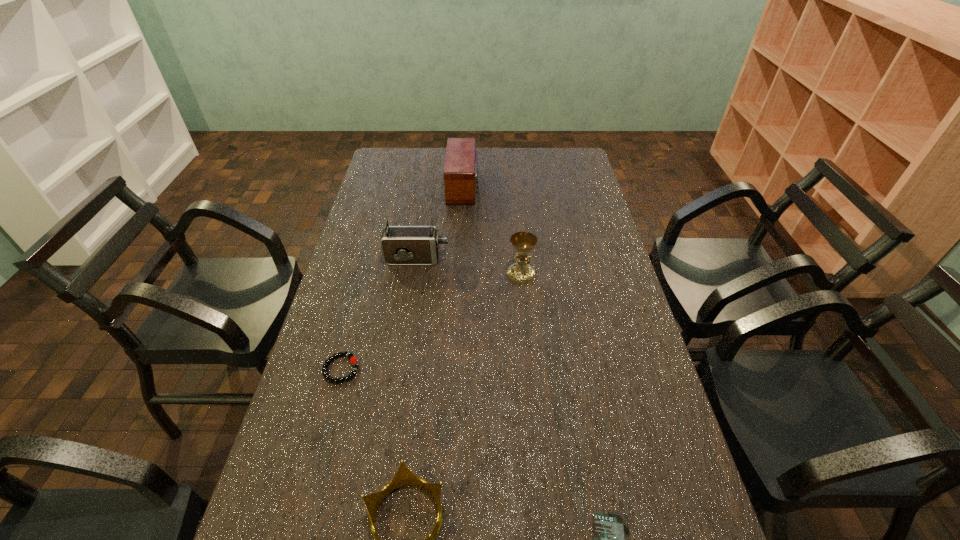
Identify which object is the fifth closest to the farthest object. Please provide its 2D coordinates. Your answer should be formatted as a tuple, i.e. [(x, y)], where the tuple contains the x and y coordinates of a point satisfying the conditions above.

[(609, 530)]

The width and height of the screenshot is (960, 540). I want to click on vacant space that satisfies the following two spatial constraints: 1. on the back side of the leftmost object; 2. on the right side of the second object from right to left, so click(x=367, y=274).

At what (x,y) coordinates should I click in order to perform the action: click on vacant space that satisfies the following two spatial constraints: 1. on the back side of the fifth object from left to right; 2. at the lens of the camcorder. Please return your answer as a coordinate pair (x, y). The height and width of the screenshot is (540, 960). Looking at the image, I should click on (519, 259).

Find the location of a particular element. The image size is (960, 540). vacant position in the image that satisfies the following two spatial constraints: 1. at the lens of the camcorder; 2. on the front side of the bracelet is located at coordinates (400, 369).

In order to click on vacant position in the image that satisfies the following two spatial constraints: 1. at the lens of the camcorder; 2. on the front side of the leftmost object in this screenshot , I will do `click(400, 369)`.